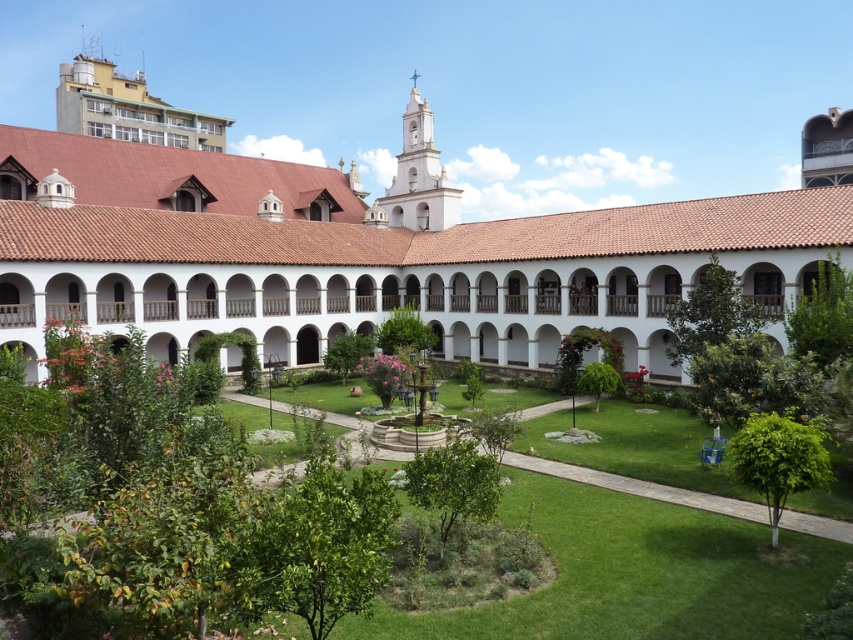
Which is in front, point (199, 216) or point (558, 572)?

Point (558, 572) is in front.

Measure the distance between white stucco building at center and camera.

white stucco building at center and camera are 34.73 meters apart from each other.

The image size is (853, 640). Find the location of `white stucco building at center`. white stucco building at center is located at coordinates (364, 252).